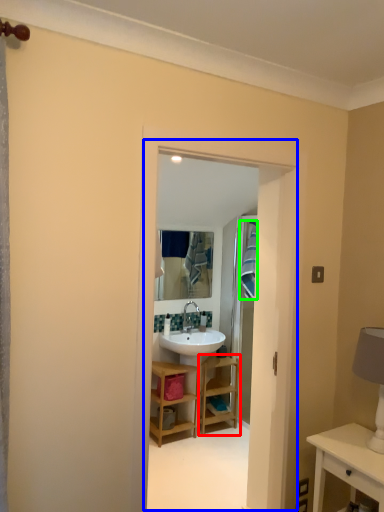
Question: Which object is positioned farthest from shelf (highlighted by a red box)? Select from residence (highlighted by a blue box) and laundry (highlighted by a green box).

Choices:
 (A) residence
 (B) laundry

Answer: (A)